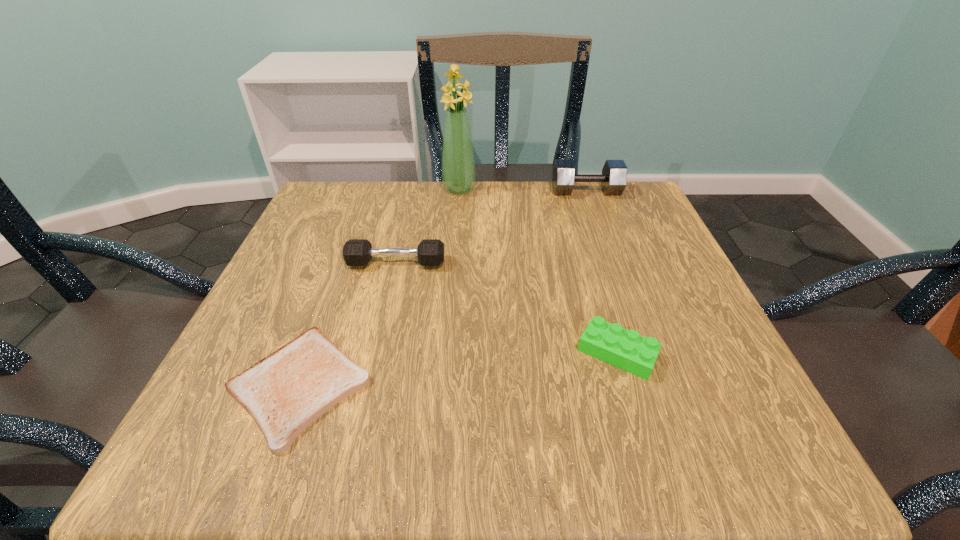
At what (x,y) coordinates should I click in order to perform the action: click on empty location between the fourth tallest object and the third shortest object. Please return your answer as a coordinate pair (x, y). The image size is (960, 540). Looking at the image, I should click on (507, 308).

Identify the location of vacant point located between the shortest object and the nearer dumbbell. This screenshot has width=960, height=540. (348, 325).

Find the location of a particular element. This screenshot has width=960, height=540. free point between the toast and the right dumbbell is located at coordinates (443, 289).

Find the location of a particular element. The image size is (960, 540). empty space that is in between the fourth tallest object and the farther dumbbell is located at coordinates (602, 272).

Where is `unoccupied position between the right dumbbell and the bouquet`? unoccupied position between the right dumbbell and the bouquet is located at coordinates (522, 190).

Locate an element on the screen. This screenshot has width=960, height=540. vacant region between the left dumbbell and the right dumbbell is located at coordinates (492, 227).

Locate an element on the screen. This screenshot has height=540, width=960. vacant area that lies between the toast and the bouquet is located at coordinates coord(379,288).

You are a GUI agent. You are given a task and a screenshot of the screen. Output one action in this format:
    pyautogui.click(x=<x>, y=<y>)
    Task: Click on the vacant space in between the bouquet and the fourth tallest object
    The image size is (960, 540).
    Given the screenshot: What is the action you would take?
    pyautogui.click(x=539, y=271)

Locate which object is the third closest to the fourth tallest object. Please provide its 2D coordinates. Your answer should be formatted as a tuple, i.e. [(x, y)], where the tuple contains the x and y coordinates of a point satisfying the conditions above.

[(613, 179)]

This screenshot has width=960, height=540. Find the location of `the fourth closest object to the bouquet`. the fourth closest object to the bouquet is located at coordinates (625, 349).